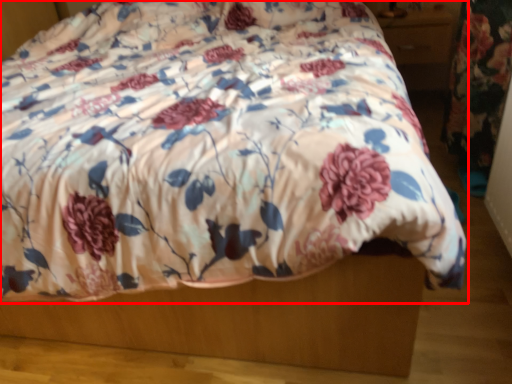
Question: From the image's perspective, where is bed (annotated by the red box) located in relation to drawer in the image?

Choices:
 (A) above
 (B) below

Answer: (B)